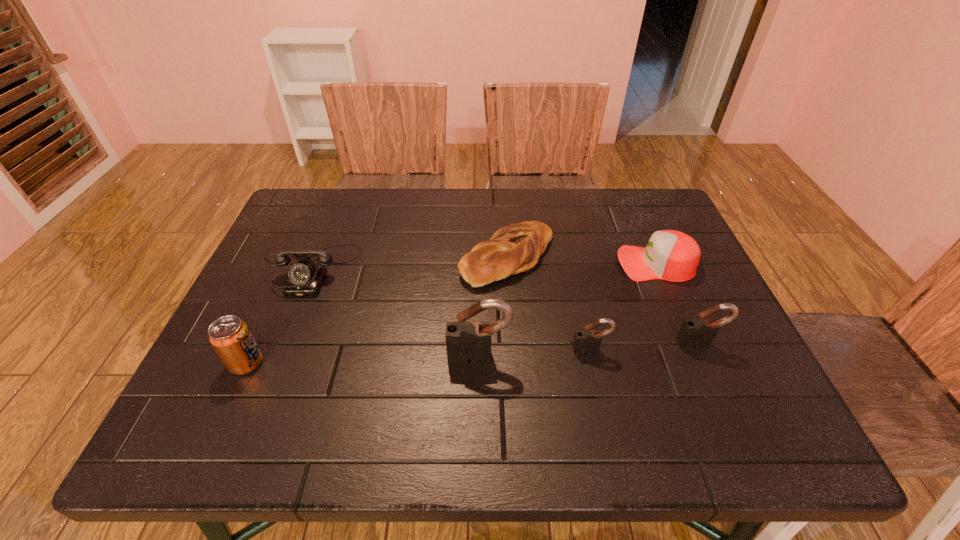
Find the location of `telephone located in the left edge section of the desktop`. telephone located in the left edge section of the desktop is located at coordinates (305, 278).

Locate an element on the screen. The image size is (960, 540). soda can situated at the left edge is located at coordinates (230, 337).

I want to click on padlock positioned at the right edge, so click(x=699, y=332).

Locate an element on the screen. The image size is (960, 540). baseball cap that is at the right edge is located at coordinates (670, 255).

Find the location of a particular element. This screenshot has height=540, width=960. object present at the near left corner is located at coordinates (230, 337).

This screenshot has width=960, height=540. I want to click on vacant space at the far edge of the desktop, so click(577, 195).

This screenshot has width=960, height=540. Find the location of `free space at the near edge of the desktop`. free space at the near edge of the desktop is located at coordinates (382, 369).

The image size is (960, 540). I want to click on vacant space at the left edge, so click(x=274, y=300).

Locate an element on the screen. The height and width of the screenshot is (540, 960). vacant space at the right edge of the desktop is located at coordinates (716, 336).

Where is `vacant area at the far left corner`? The height and width of the screenshot is (540, 960). vacant area at the far left corner is located at coordinates (328, 203).